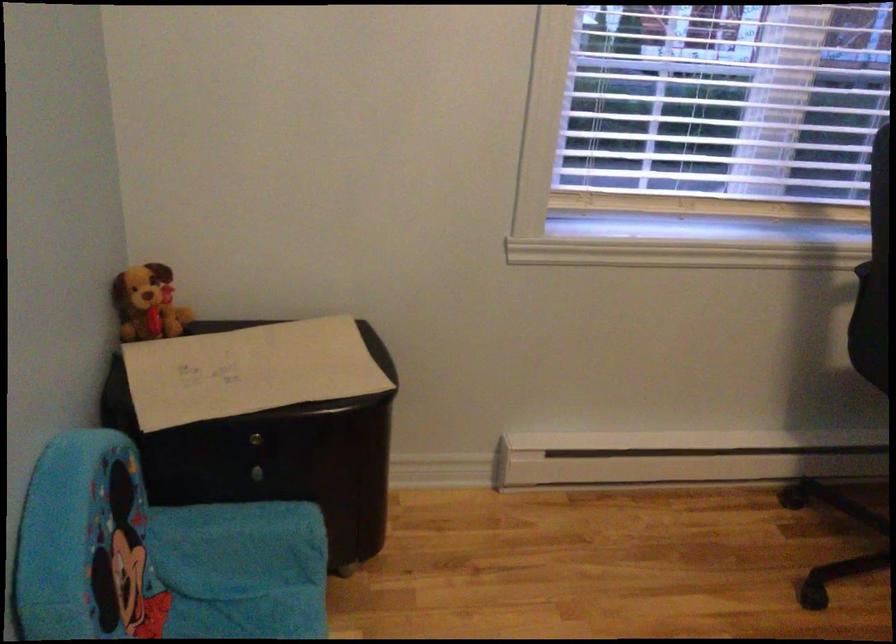
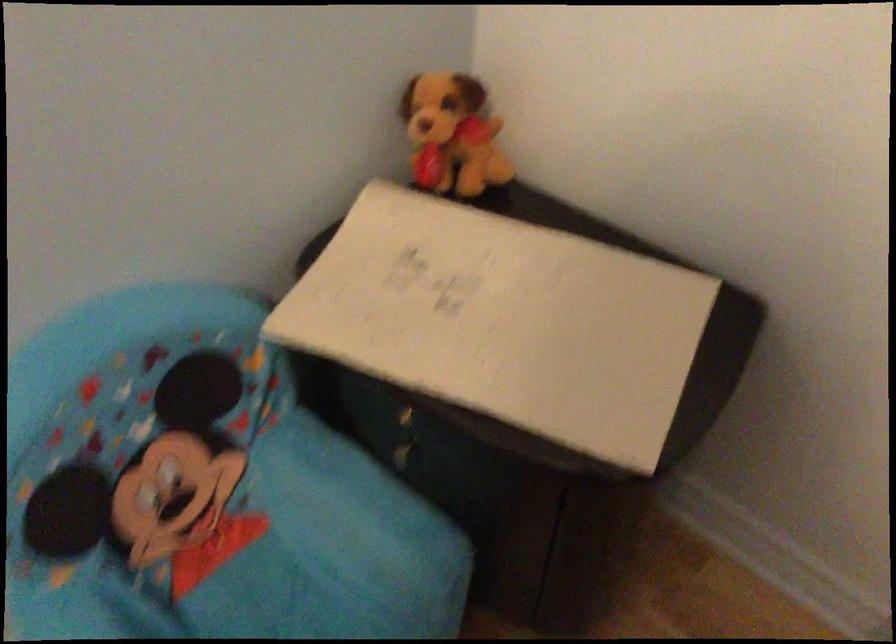
In the second image, find the point that corresponds to [280,370] in the first image.

(521, 323)